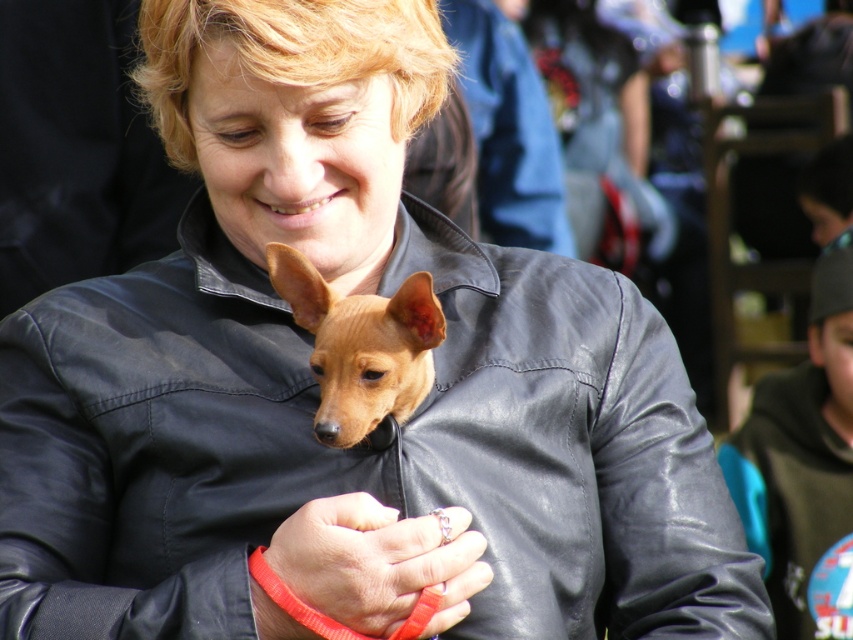
Does dark green hoodie at lower right have a lesser width compared to brown leather dog at center?

In fact, dark green hoodie at lower right might be wider than brown leather dog at center.

Between point (807, 442) and point (404, 371), which one is positioned behind?

The point (807, 442) is more distant.

Is point (795, 529) more distant than point (413, 352)?

Yes, point (795, 529) is farther from viewer.

Image resolution: width=853 pixels, height=640 pixels. In order to click on dark green hoodie at lower right in this screenshot , I will do `click(804, 465)`.

In the scene shown: Between leather ring at center and brown leather dog at center, which one is positioned higher?

brown leather dog at center is above.

Is leather ring at center bigger than brown leather dog at center?

Actually, leather ring at center might be smaller than brown leather dog at center.

Between point (433, 538) and point (357, 387), which one is positioned in front?

Point (357, 387) is more forward.

Locate an element on the screen. The width and height of the screenshot is (853, 640). leather ring at center is located at coordinates (376, 561).

Does dark green hoodie at lower right have a lesser width compared to leather ring at center?

In fact, dark green hoodie at lower right might be wider than leather ring at center.

Where is `dark green hoodie at lower right`? This screenshot has width=853, height=640. dark green hoodie at lower right is located at coordinates (804, 465).

I want to click on dark green hoodie at lower right, so click(804, 465).